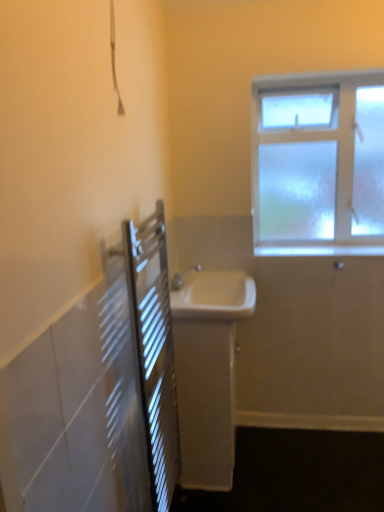
Question: Considering the relative positions of white glossy sink at center, the first sink ordered from the bottom, and white glossy window sill at upper right in the image provided, is white glossy sink at center, the first sink ordered from the bottom, to the right of white glossy window sill at upper right from the viewer's perspective?

Choices:
 (A) yes
 (B) no

Answer: (B)

Question: Does white glossy sink at center, the first sink ordered from the bottom, have a lesser height compared to white glossy window sill at upper right?

Choices:
 (A) yes
 (B) no

Answer: (B)

Question: Considering the relative sizes of white glossy sink at center, the first sink ordered from the bottom, and white glossy window sill at upper right in the image provided, is white glossy sink at center, the first sink ordered from the bottom, bigger than white glossy window sill at upper right?

Choices:
 (A) yes
 (B) no

Answer: (A)

Question: Can you confirm if white glossy sink at center, which is the second sink in top-to-bottom order, is wider than white glossy window sill at upper right?

Choices:
 (A) no
 (B) yes

Answer: (B)

Question: From a real-world perspective, is white glossy sink at center, the first sink ordered from the bottom, positioned under white glossy window sill at upper right based on gravity?

Choices:
 (A) no
 (B) yes

Answer: (B)

Question: Considering the positions of point (140, 275) and point (183, 425), is point (140, 275) closer or farther from the camera than point (183, 425)?

Choices:
 (A) closer
 (B) farther

Answer: (A)

Question: Is metallic silver radiator at left to the left or to the right of white glossy sink at center, the first sink ordered from the bottom, in the image?

Choices:
 (A) left
 (B) right

Answer: (A)

Question: Considering the positions of metallic silver radiator at left and white glossy sink at center, the first sink ordered from the bottom, in the image, is metallic silver radiator at left taller or shorter than white glossy sink at center, the first sink ordered from the bottom,?

Choices:
 (A) tall
 (B) short

Answer: (A)

Question: In terms of width, does metallic silver radiator at left look wider or thinner when compared to white glossy sink at center, the first sink ordered from the bottom?

Choices:
 (A) wide
 (B) thin

Answer: (B)

Question: In terms of width, does frosted glass window at upper right look wider or thinner when compared to metallic silver radiator at left?

Choices:
 (A) wide
 (B) thin

Answer: (A)

Question: From their relative heights in the image, would you say frosted glass window at upper right is taller or shorter than metallic silver radiator at left?

Choices:
 (A) tall
 (B) short

Answer: (B)

Question: Do you think frosted glass window at upper right is within metallic silver radiator at left, or outside of it?

Choices:
 (A) outside
 (B) inside

Answer: (A)

Question: Does point (367, 92) appear closer or farther from the camera than point (147, 234)?

Choices:
 (A) farther
 (B) closer

Answer: (A)

Question: Relative to white glossy window sill at upper right, is metallic silver radiator at left in front or behind?

Choices:
 (A) front
 (B) behind

Answer: (A)

Question: In terms of size, does metallic silver radiator at left appear bigger or smaller than white glossy window sill at upper right?

Choices:
 (A) big
 (B) small

Answer: (A)